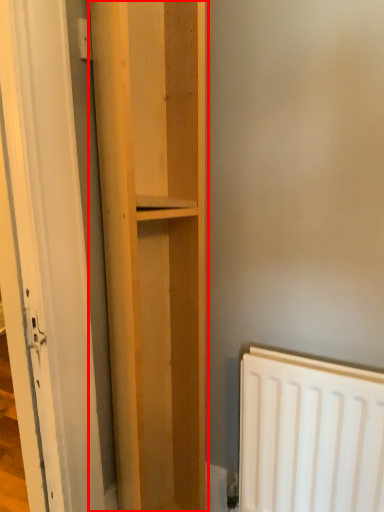
Question: From the image's perspective, what is the correct spatial relationship of cupboard (annotated by the red box) in relation to door?

Choices:
 (A) below
 (B) above

Answer: (A)